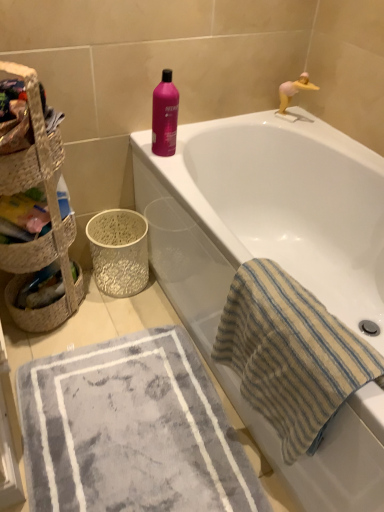
Question: From their relative heights in the image, would you say pink plastic toy at upper right is taller or shorter than woven straw basket at left, the second basket viewed from the top?

Choices:
 (A) tall
 (B) short

Answer: (B)

Question: From a real-world perspective, is pink plastic toy at upper right positioned above or below woven straw basket at left, the second basket viewed from the top?

Choices:
 (A) below
 (B) above

Answer: (B)

Question: Estimate the real-world distances between objects in this image. Which object is closer to the white textured basket at lower left, acting as the second basket container starting from the front?

Choices:
 (A) gray plush bath mat at lower left
 (B) woven straw basket at left, positioned as the first basket container in top-to-bottom order
 (C) white glossy bathtub at upper center
 (D) woven straw basket at left, arranged as the 1th basket when ordered from the bottom
 (E) pink glossy bottle at upper center

Answer: (D)

Question: Which object is the farthest from the beige striped towel at right?

Choices:
 (A) woven straw basket at left, positioned as the second basket container in bottom-to-top order
 (B) woven straw basket at left, arranged as the 1th basket when viewed from the top
 (C) woven straw basket at left, the second basket viewed from the top
 (D) pink plastic toy at upper right
 (E) pink glossy bottle at upper center

Answer: (D)